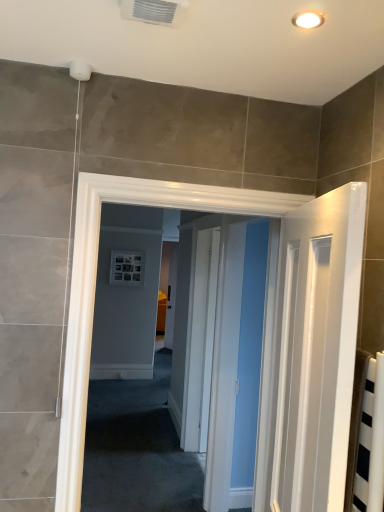
This screenshot has height=512, width=384. I want to click on warm matte light fixture at upper center, so click(x=308, y=19).

This screenshot has width=384, height=512. What do you see at coordinates (308, 19) in the screenshot?
I see `warm matte light fixture at upper center` at bounding box center [308, 19].

Find the location of a particular element. white plastic air conditioning unit at upper center is located at coordinates (155, 11).

Image resolution: width=384 pixels, height=512 pixels. Describe the element at coordinates (155, 11) in the screenshot. I see `white plastic air conditioning unit at upper center` at that location.

Locate an element on the screen. The width and height of the screenshot is (384, 512). warm matte light fixture at upper center is located at coordinates (308, 19).

Which object is positioned more to the right, white plastic air conditioning unit at upper center or warm matte light fixture at upper center?

warm matte light fixture at upper center is more to the right.

Considering their positions, is white plastic air conditioning unit at upper center located in front of or behind warm matte light fixture at upper center?

white plastic air conditioning unit at upper center is positioned closer to the viewer than warm matte light fixture at upper center.

Between point (169, 9) and point (296, 20), which one is positioned in front?

The point (169, 9) is in front.

From the image's perspective, which is below, white plastic air conditioning unit at upper center or warm matte light fixture at upper center?

warm matte light fixture at upper center, from the image's perspective.

Looking at this image, from a real-world perspective, is white plastic air conditioning unit at upper center located beneath warm matte light fixture at upper center?

Correct, in the physical world, white plastic air conditioning unit at upper center is lower than warm matte light fixture at upper center.

Which of these two, white plastic air conditioning unit at upper center or warm matte light fixture at upper center, is thinner?

With smaller width is warm matte light fixture at upper center.

Is white plastic air conditioning unit at upper center taller or shorter than warm matte light fixture at upper center?

Considering their sizes, white plastic air conditioning unit at upper center has more height than warm matte light fixture at upper center.

Considering the sizes of objects white plastic air conditioning unit at upper center and warm matte light fixture at upper center in the image provided, who is smaller, white plastic air conditioning unit at upper center or warm matte light fixture at upper center?

warm matte light fixture at upper center is smaller.

Does white plastic air conditioning unit at upper center contain warm matte light fixture at upper center?

No, warm matte light fixture at upper center is not inside white plastic air conditioning unit at upper center.

Based on the photo, is white plastic air conditioning unit at upper center not near warm matte light fixture at upper center?

white plastic air conditioning unit at upper center is actually quite close to warm matte light fixture at upper center.

Is white plastic air conditioning unit at upper center positioned with its back to warm matte light fixture at upper center?

white plastic air conditioning unit at upper center does not have its back to warm matte light fixture at upper center.

How many degrees apart are the facing directions of white plastic air conditioning unit at upper center and warm matte light fixture at upper center?

There is a 1.39-degree angle between the facing directions of white plastic air conditioning unit at upper center and warm matte light fixture at upper center.

Could you measure the distance between white plastic air conditioning unit at upper center and warm matte light fixture at upper center?

white plastic air conditioning unit at upper center and warm matte light fixture at upper center are 13.02 inches apart from each other.

Find the location of `air conditioning directly beneath the warm matte light fixture at upper center (from a real-world perspective)`. air conditioning directly beneath the warm matte light fixture at upper center (from a real-world perspective) is located at coordinates (155, 11).

Can you confirm if warm matte light fixture at upper center is positioned to the left of white plastic air conditioning unit at upper center?

Incorrect, warm matte light fixture at upper center is not on the left side of white plastic air conditioning unit at upper center.

Is the depth of warm matte light fixture at upper center greater than that of white plastic air conditioning unit at upper center?

Yes, it is.

Considering the points (302, 22) and (170, 22), which point is behind, point (302, 22) or point (170, 22)?

The point (170, 22) is more distant.

From the image's perspective, is warm matte light fixture at upper center above or below white plastic air conditioning unit at upper center?

warm matte light fixture at upper center is situated lower than white plastic air conditioning unit at upper center in the image.

From a real-world perspective, is warm matte light fixture at upper center above or below white plastic air conditioning unit at upper center?

warm matte light fixture at upper center is situated higher than white plastic air conditioning unit at upper center in the real world.

Consider the image. Can you confirm if warm matte light fixture at upper center is thinner than white plastic air conditioning unit at upper center?

Correct, the width of warm matte light fixture at upper center is less than that of white plastic air conditioning unit at upper center.

Considering the sizes of objects warm matte light fixture at upper center and white plastic air conditioning unit at upper center in the image provided, who is taller, warm matte light fixture at upper center or white plastic air conditioning unit at upper center?

With more height is white plastic air conditioning unit at upper center.

Which of these two, warm matte light fixture at upper center or white plastic air conditioning unit at upper center, is bigger?

Bigger between the two is white plastic air conditioning unit at upper center.

From the picture: Would you say warm matte light fixture at upper center is outside white plastic air conditioning unit at upper center?

That's correct, warm matte light fixture at upper center is outside of white plastic air conditioning unit at upper center.

Can you see warm matte light fixture at upper center touching white plastic air conditioning unit at upper center?

warm matte light fixture at upper center and white plastic air conditioning unit at upper center are clearly separated.

Is warm matte light fixture at upper center facing towards white plastic air conditioning unit at upper center?

No, warm matte light fixture at upper center does not turn towards white plastic air conditioning unit at upper center.

Can you tell me how much warm matte light fixture at upper center and white plastic air conditioning unit at upper center differ in facing direction?

The facing directions of warm matte light fixture at upper center and white plastic air conditioning unit at upper center are 1.39 degrees apart.

Identify the location of light fixture that is on the right side of white plastic air conditioning unit at upper center. This screenshot has height=512, width=384. (308, 19).

This screenshot has height=512, width=384. Find the location of `light fixture on the right of white plastic air conditioning unit at upper center`. light fixture on the right of white plastic air conditioning unit at upper center is located at coordinates (308, 19).

At what (x,y) coordinates should I click in order to perform the action: click on light fixture that is above the white plastic air conditioning unit at upper center (from a real-world perspective). Please return your answer as a coordinate pair (x, y). Looking at the image, I should click on (308, 19).